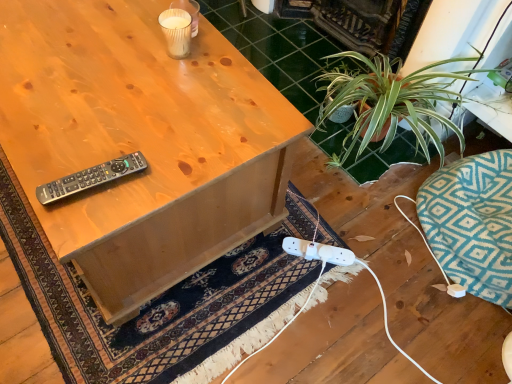
Question: Considering the positions of point (298, 281) and point (223, 64), is point (298, 281) closer or farther from the camera than point (223, 64)?

Choices:
 (A) closer
 (B) farther

Answer: (B)

Question: From the image's perspective, is dark blue woven rug at lower center positioned above or below matte wood desk at center?

Choices:
 (A) below
 (B) above

Answer: (A)

Question: Based on their relative distances, which object is nearer to the matte wood desk at center?

Choices:
 (A) black plastic remote at upper left
 (B) dark blue woven rug at lower center

Answer: (A)

Question: Which of these objects is positioned closest to the black plastic remote at upper left?

Choices:
 (A) matte wood desk at center
 (B) dark blue woven rug at lower center

Answer: (A)